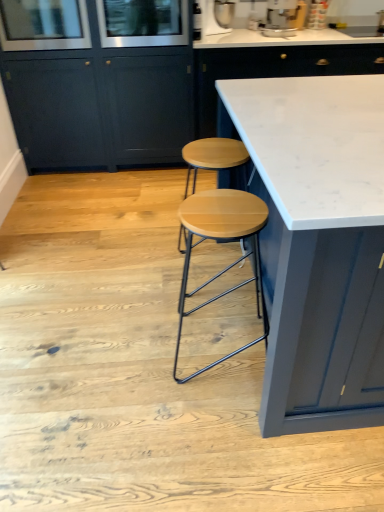
Describe the element at coordinates (320, 245) in the screenshot. I see `white marble countertop at center` at that location.

The height and width of the screenshot is (512, 384). Find the location of `metallic silver stand mixer at upper center, marked as the 2th appliance in a right-to-left arrangement`. metallic silver stand mixer at upper center, marked as the 2th appliance in a right-to-left arrangement is located at coordinates (206, 19).

Describe the element at coordinates (224, 241) in the screenshot. I see `wooden seat stool at center` at that location.

Where is `wooden seat stool at center`? The image size is (384, 512). wooden seat stool at center is located at coordinates (224, 241).

What do you see at coordinates (274, 69) in the screenshot? The width and height of the screenshot is (384, 512). I see `white marble countertop at center, the 1th cabinetry viewed from the right` at bounding box center [274, 69].

Locate an element on the screen. This screenshot has width=384, height=512. clear glass screen door at upper left, which ranks as the first screen door in left-to-right order is located at coordinates (44, 25).

Identify the location of white marble countertop at center. (320, 245).

Is white marble countertop at center turned away from matte dark blue cabinet at center, acting as the first cabinetry starting from the left?

No.

Considering the relative positions of white marble countertop at center and matte dark blue cabinet at center, acting as the first cabinetry starting from the left, in the image provided, is white marble countertop at center behind matte dark blue cabinet at center, acting as the first cabinetry starting from the left,?

No.

From the image's perspective, which one is positioned higher, white marble countertop at center or matte dark blue cabinet at center, which is the 2th cabinetry in right-to-left order?

matte dark blue cabinet at center, which is the 2th cabinetry in right-to-left order.

Between white marble countertop at center and matte dark blue cabinet at center, acting as the first cabinetry starting from the left, which one has larger size?

Bigger between the two is white marble countertop at center.

Considering the relative sizes of matte dark blue cabinet at center, which is the 2th cabinetry in right-to-left order, and clear glass screen door at upper left, which ranks as the first screen door in left-to-right order, in the image provided, is matte dark blue cabinet at center, which is the 2th cabinetry in right-to-left order, bigger than clear glass screen door at upper left, which ranks as the first screen door in left-to-right order,?

Yes.

From a real-world perspective, between matte dark blue cabinet at center, acting as the first cabinetry starting from the left, and clear glass screen door at upper left, which ranks as the first screen door in left-to-right order, who is vertically higher?

clear glass screen door at upper left, which ranks as the first screen door in left-to-right order, is physically above.

From the image's perspective, is matte dark blue cabinet at center, which is the 2th cabinetry in right-to-left order, positioned above or below clear glass screen door at upper left, acting as the 2th screen door starting from the right?

Clearly, from the image's perspective, matte dark blue cabinet at center, which is the 2th cabinetry in right-to-left order, is below clear glass screen door at upper left, acting as the 2th screen door starting from the right.

What's the angular difference between matte dark blue cabinet at center, acting as the first cabinetry starting from the left, and clear glass screen door at upper left, acting as the 2th screen door starting from the right,'s facing directions?

The angle between the facing direction of matte dark blue cabinet at center, acting as the first cabinetry starting from the left, and the facing direction of clear glass screen door at upper left, acting as the 2th screen door starting from the right, is 0.234 degrees.

Looking at their sizes, would you say white marble countertop at center, which ranks as the second cabinetry in left-to-right order, is wider or thinner than metallic silver stand mixer at upper center, marked as the 2th appliance in a right-to-left arrangement?

Considering their sizes, white marble countertop at center, which ranks as the second cabinetry in left-to-right order, looks broader than metallic silver stand mixer at upper center, marked as the 2th appliance in a right-to-left arrangement.

Is white marble countertop at center, which ranks as the second cabinetry in left-to-right order, in front of or behind metallic silver stand mixer at upper center, placed as the first appliance when sorted from left to right, in the image?

In the image, white marble countertop at center, which ranks as the second cabinetry in left-to-right order, appears in front of metallic silver stand mixer at upper center, placed as the first appliance when sorted from left to right.

Based on the photo, from the image's perspective, is white marble countertop at center, which ranks as the second cabinetry in left-to-right order, below metallic silver stand mixer at upper center, marked as the 2th appliance in a right-to-left arrangement?

Indeed, from the image's perspective, white marble countertop at center, which ranks as the second cabinetry in left-to-right order, is shown beneath metallic silver stand mixer at upper center, marked as the 2th appliance in a right-to-left arrangement.

From a real-world perspective, is white marble countertop at center, the 1th cabinetry viewed from the right, under metallic silver stand mixer at upper center, placed as the first appliance when sorted from left to right?

Yes, from a real-world perspective, white marble countertop at center, the 1th cabinetry viewed from the right, is beneath metallic silver stand mixer at upper center, placed as the first appliance when sorted from left to right.

Which is less distant, [231,240] or [109,47]?

Point [231,240] is closer to the camera than point [109,47].

From the image's perspective, is wooden seat stool at center over clear glass screen door at upper center, which ranks as the second screen door in left-to-right order?

No.

How distant is wooden seat stool at center from clear glass screen door at upper center, which ranks as the second screen door in left-to-right order?

wooden seat stool at center is 1.64 meters away from clear glass screen door at upper center, which ranks as the second screen door in left-to-right order.

Consider the image. What's the angular difference between wooden seat stool at center and clear glass screen door at upper center, which ranks as the second screen door in left-to-right order,'s facing directions?

They differ by 88.8 degrees in their facing directions.

Is matte dark blue cabinet at center, acting as the first cabinetry starting from the left, to the right of clear glass screen door at upper center, which ranks as the second screen door in left-to-right order, from the viewer's perspective?

No.

Between matte dark blue cabinet at center, acting as the first cabinetry starting from the left, and clear glass screen door at upper center, the 1th screen door in the right-to-left sequence, which one is positioned in front?

Positioned in front is matte dark blue cabinet at center, acting as the first cabinetry starting from the left.

Is matte dark blue cabinet at center, acting as the first cabinetry starting from the left, directly adjacent to clear glass screen door at upper center, the 1th screen door in the right-to-left sequence?

No, matte dark blue cabinet at center, acting as the first cabinetry starting from the left, is not making contact with clear glass screen door at upper center, the 1th screen door in the right-to-left sequence.

From the image's perspective, which is above, matte dark blue cabinet at center, which is the 2th cabinetry in right-to-left order, or clear glass screen door at upper center, which ranks as the second screen door in left-to-right order?

From the image's view, clear glass screen door at upper center, which ranks as the second screen door in left-to-right order, is above.

Does wooden seat stool at center turn towards metallic silver coffee machine at upper center, which is counted as the second appliance, starting from the left?

No, wooden seat stool at center does not turn towards metallic silver coffee machine at upper center, which is counted as the second appliance, starting from the left.

From the image's perspective, is wooden seat stool at center located above or below metallic silver coffee machine at upper center, the first appliance when ordered from right to left?

wooden seat stool at center is situated lower than metallic silver coffee machine at upper center, the first appliance when ordered from right to left, in the image.

Is the surface of wooden seat stool at center in direct contact with metallic silver coffee machine at upper center, the first appliance when ordered from right to left?

No, wooden seat stool at center is not making contact with metallic silver coffee machine at upper center, the first appliance when ordered from right to left.

Is clear glass screen door at upper left, acting as the 2th screen door starting from the right, wider or thinner than wooden seat stool at center?

Clearly, clear glass screen door at upper left, acting as the 2th screen door starting from the right, has more width compared to wooden seat stool at center.

Considering their positions, is clear glass screen door at upper left, which ranks as the first screen door in left-to-right order, located in front of or behind wooden seat stool at center?

Clearly, clear glass screen door at upper left, which ranks as the first screen door in left-to-right order, is behind wooden seat stool at center.

Is clear glass screen door at upper left, which ranks as the first screen door in left-to-right order, completely or partially outside of wooden seat stool at center?

Yes, clear glass screen door at upper left, which ranks as the first screen door in left-to-right order, is outside of wooden seat stool at center.

Identify the location of the 1st screen door behind the wooden seat stool at center. This screenshot has width=384, height=512. (44, 25).

Identify the location of cabinetry on the left of the white marble countertop at center. The image size is (384, 512). (98, 81).

The height and width of the screenshot is (512, 384). I want to click on the 1st cabinetry below the clear glass screen door at upper left, acting as the 2th screen door starting from the right (from a real-world perspective), so click(98, 81).

Estimate the real-world distances between objects in this image. Which object is further from metallic silver coffee machine at upper center, the first appliance when ordered from right to left, wooden seat stool at center or white marble countertop at center, the 1th cabinetry viewed from the right?

wooden seat stool at center is further to metallic silver coffee machine at upper center, the first appliance when ordered from right to left.

When comparing their distances from clear glass screen door at upper left, which ranks as the first screen door in left-to-right order, does metallic silver coffee machine at upper center, the first appliance when ordered from right to left, or metallic silver stand mixer at upper center, marked as the 2th appliance in a right-to-left arrangement, seem further?

metallic silver coffee machine at upper center, the first appliance when ordered from right to left, is further to clear glass screen door at upper left, which ranks as the first screen door in left-to-right order.

Estimate the real-world distances between objects in this image. Which object is closer to white marble countertop at center, clear glass screen door at upper left, acting as the 2th screen door starting from the right, or metallic silver coffee machine at upper center, the first appliance when ordered from right to left?

The object closer to white marble countertop at center is clear glass screen door at upper left, acting as the 2th screen door starting from the right.

Looking at the image, which one is located further to white marble countertop at center, the 1th cabinetry viewed from the right, metallic silver coffee machine at upper center, which is counted as the second appliance, starting from the left, or wooden seat stool at center?

Among the two, wooden seat stool at center is located further to white marble countertop at center, the 1th cabinetry viewed from the right.

From the image, which object appears to be nearer to white marble countertop at center, the 1th cabinetry viewed from the right, clear glass screen door at upper left, acting as the 2th screen door starting from the right, or matte dark blue cabinet at center, which is the 2th cabinetry in right-to-left order?

matte dark blue cabinet at center, which is the 2th cabinetry in right-to-left order, lies closer to white marble countertop at center, the 1th cabinetry viewed from the right, than the other object.

In the scene shown: Which object lies further to the anchor point wooden seat stool at center, white marble countertop at center, the 1th cabinetry viewed from the right, or metallic silver coffee machine at upper center, the first appliance when ordered from right to left?

Based on the image, metallic silver coffee machine at upper center, the first appliance when ordered from right to left, appears to be further to wooden seat stool at center.

Looking at the image, which one is located further to wooden seat stool at center, clear glass screen door at upper center, which ranks as the second screen door in left-to-right order, or white marble countertop at center?

Among the two, clear glass screen door at upper center, which ranks as the second screen door in left-to-right order, is located further to wooden seat stool at center.

Considering their positions, is white marble countertop at center, the 1th cabinetry viewed from the right, positioned closer to metallic silver stand mixer at upper center, placed as the first appliance when sorted from left to right, than white marble countertop at center?

The object closer to metallic silver stand mixer at upper center, placed as the first appliance when sorted from left to right, is white marble countertop at center, the 1th cabinetry viewed from the right.

The width and height of the screenshot is (384, 512). I want to click on stool located between white marble countertop at center and matte dark blue cabinet at center, acting as the first cabinetry starting from the left, in the depth direction, so click(x=224, y=241).

You are a GUI agent. You are given a task and a screenshot of the screen. Output one action in this format:
    pyautogui.click(x=<x>, y=<y>)
    Task: Click on the cabinetry located between clear glass screen door at upper left, which ranks as the first screen door in left-to-right order, and metallic silver stand mixer at upper center, marked as the 2th appliance in a right-to-left arrangement, in the left-right direction
    This screenshot has height=512, width=384.
    Given the screenshot: What is the action you would take?
    pyautogui.click(x=98, y=81)

Locate an element on the screen. The height and width of the screenshot is (512, 384). screen door between clear glass screen door at upper center, which ranks as the second screen door in left-to-right order, and wooden seat stool at center in the up-down direction is located at coordinates (44, 25).

The height and width of the screenshot is (512, 384). I want to click on appliance between white marble countertop at center and metallic silver stand mixer at upper center, placed as the first appliance when sorted from left to right, in the front-back direction, so [x=283, y=18].